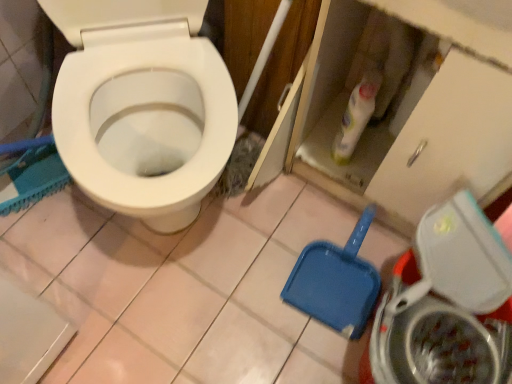
Question: From the image's perspective, is white glossy bottle at upper center above metallic silver washing machine at lower right?

Choices:
 (A) no
 (B) yes

Answer: (B)

Question: Is white glossy bottle at upper center at the left side of metallic silver washing machine at lower right?

Choices:
 (A) yes
 (B) no

Answer: (A)

Question: Can you confirm if white glossy bottle at upper center is bigger than metallic silver washing machine at lower right?

Choices:
 (A) no
 (B) yes

Answer: (A)

Question: Can you confirm if white glossy bottle at upper center is thinner than metallic silver washing machine at lower right?

Choices:
 (A) no
 (B) yes

Answer: (B)

Question: Can you confirm if white glossy bottle at upper center is smaller than metallic silver washing machine at lower right?

Choices:
 (A) no
 (B) yes

Answer: (B)

Question: From a real-world perspective, is white glossy bottle at upper center on top of metallic silver washing machine at lower right?

Choices:
 (A) yes
 (B) no

Answer: (A)

Question: Is white glossy bottle at upper center shorter than blue plastic shovel at lower right?

Choices:
 (A) yes
 (B) no

Answer: (B)

Question: Can you confirm if white glossy bottle at upper center is bigger than blue plastic shovel at lower right?

Choices:
 (A) yes
 (B) no

Answer: (B)

Question: Is white glossy bottle at upper center positioned behind blue plastic shovel at lower right?

Choices:
 (A) no
 (B) yes

Answer: (A)

Question: Is white glossy bottle at upper center beside blue plastic shovel at lower right?

Choices:
 (A) yes
 (B) no

Answer: (B)

Question: From a real-world perspective, is white glossy bottle at upper center physically below blue plastic shovel at lower right?

Choices:
 (A) no
 (B) yes

Answer: (A)

Question: From a real-world perspective, does white glossy bottle at upper center stand above blue plastic shovel at lower right?

Choices:
 (A) no
 (B) yes

Answer: (B)

Question: From a real-world perspective, is metallic silver washing machine at lower right positioned under white glossy bottle at upper center based on gravity?

Choices:
 (A) yes
 (B) no

Answer: (A)